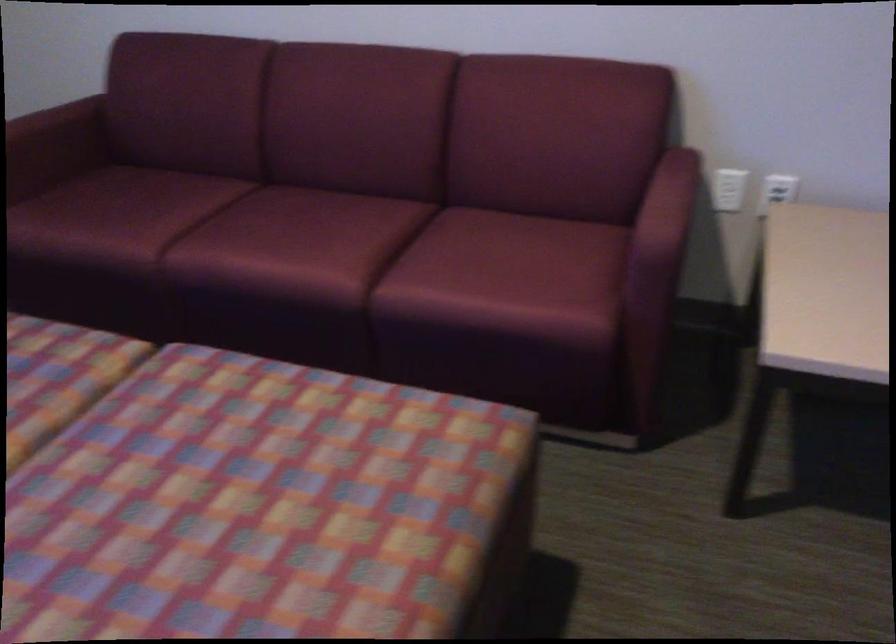
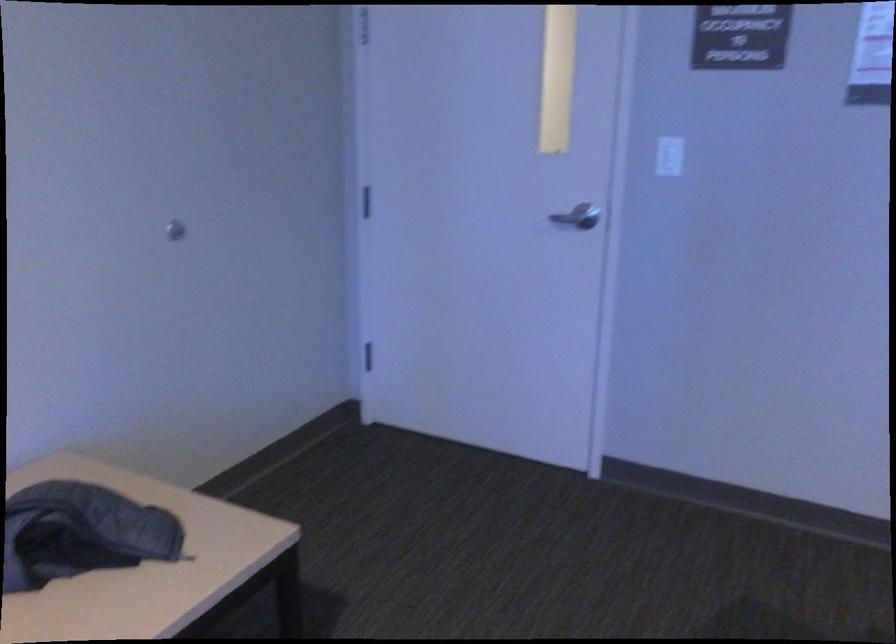
Question: The camera is either moving clockwise (left) or counter-clockwise (right) around the object. The first image is from the beginning of the video and the second image is from the end. Is the camera moving left or right when shooting the video?

Choices:
 (A) Left
 (B) Right

Answer: (A)